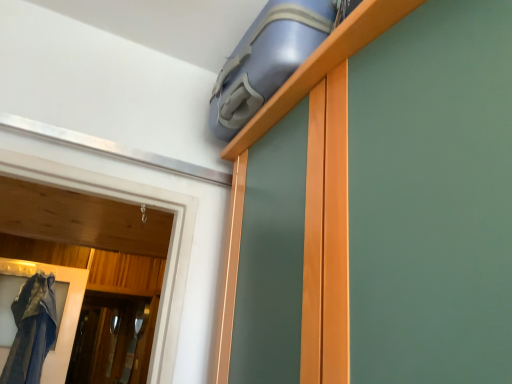
This screenshot has height=384, width=512. What do you see at coordinates (322, 65) in the screenshot?
I see `blue rubber suitcase at upper center` at bounding box center [322, 65].

At what (x,y) coordinates should I click in order to perform the action: click on blue rubber suitcase at upper center. Please return your answer as a coordinate pair (x, y). Looking at the image, I should click on (322, 65).

What do you see at coordinates (113, 339) in the screenshot?
I see `transparent glass screen door at lower left` at bounding box center [113, 339].

The image size is (512, 384). I want to click on transparent glass screen door at lower left, so coord(113,339).

At what (x,y) coordinates should I click in order to perform the action: click on blue rubber suitcase at upper center. Please return your answer as a coordinate pair (x, y). Image resolution: width=512 pixels, height=384 pixels. Looking at the image, I should click on (322, 65).

Based on the photo, is transparent glass screen door at lower left to the left of blue rubber suitcase at upper center from the viewer's perspective?

Yes.

Looking at this image, is transparent glass screen door at lower left positioned in front of blue rubber suitcase at upper center?

No, transparent glass screen door at lower left is further to the viewer.

Considering the points (118, 331) and (370, 16), which point is in front, point (118, 331) or point (370, 16)?

Point (370, 16)

Based on the photo, from the image's perspective, which is below, transparent glass screen door at lower left or blue rubber suitcase at upper center?

transparent glass screen door at lower left is shown below in the image.

From a real-world perspective, is transparent glass screen door at lower left over blue rubber suitcase at upper center?

No.

Considering the sizes of objects transparent glass screen door at lower left and blue rubber suitcase at upper center in the image provided, who is thinner, transparent glass screen door at lower left or blue rubber suitcase at upper center?

Result: Thinner between the two is transparent glass screen door at lower left.

Does transparent glass screen door at lower left have a greater height compared to blue rubber suitcase at upper center?

Yes.

Who is bigger, transparent glass screen door at lower left or blue rubber suitcase at upper center?

blue rubber suitcase at upper center.

Is transparent glass screen door at lower left not within blue rubber suitcase at upper center?

transparent glass screen door at lower left lies outside blue rubber suitcase at upper center's area.

Is transparent glass screen door at lower left positioned far away from blue rubber suitcase at upper center?

That's right, there is a large distance between transparent glass screen door at lower left and blue rubber suitcase at upper center.

Is transparent glass screen door at lower left positioned with its back to blue rubber suitcase at upper center?

No, transparent glass screen door at lower left's orientation is not away from blue rubber suitcase at upper center.

How much distance is there between transparent glass screen door at lower left and blue rubber suitcase at upper center?

transparent glass screen door at lower left is 2.91 meters from blue rubber suitcase at upper center.

Locate an element on the screen. The width and height of the screenshot is (512, 384). screen door below the blue rubber suitcase at upper center (from a real-world perspective) is located at coordinates (113, 339).

In the image, is blue rubber suitcase at upper center on the left side or the right side of transparent glass screen door at lower left?

In the image, blue rubber suitcase at upper center appears on the right side of transparent glass screen door at lower left.

Between blue rubber suitcase at upper center and transparent glass screen door at lower left, which one is positioned in front?

blue rubber suitcase at upper center is in front.

Which is behind, point (374, 4) or point (108, 298)?

The point (108, 298) is behind.

From the image's perspective, which is below, blue rubber suitcase at upper center or transparent glass screen door at lower left?

transparent glass screen door at lower left.

From a real-world perspective, which is physically below, blue rubber suitcase at upper center or transparent glass screen door at lower left?

transparent glass screen door at lower left.

Considering the sizes of objects blue rubber suitcase at upper center and transparent glass screen door at lower left in the image provided, who is thinner, blue rubber suitcase at upper center or transparent glass screen door at lower left?

Thinner between the two is transparent glass screen door at lower left.

Between blue rubber suitcase at upper center and transparent glass screen door at lower left, which one has more height?

transparent glass screen door at lower left is taller.

Does blue rubber suitcase at upper center have a smaller size compared to transparent glass screen door at lower left?

No.

Would you say transparent glass screen door at lower left is part of blue rubber suitcase at upper center's contents?

No, blue rubber suitcase at upper center does not contain transparent glass screen door at lower left.

Is blue rubber suitcase at upper center not close to transparent glass screen door at lower left?

blue rubber suitcase at upper center is far away from transparent glass screen door at lower left.

Does blue rubber suitcase at upper center turn towards transparent glass screen door at lower left?

No, blue rubber suitcase at upper center is not facing towards transparent glass screen door at lower left.

How many degrees apart are the facing directions of blue rubber suitcase at upper center and transparent glass screen door at lower left?

blue rubber suitcase at upper center and transparent glass screen door at lower left are facing 87.8 degrees away from each other.

Measure the distance from blue rubber suitcase at upper center to transparent glass screen door at lower left.

blue rubber suitcase at upper center is 2.91 meters away from transparent glass screen door at lower left.

Locate an element on the screen. The width and height of the screenshot is (512, 384). shelf in front of the transparent glass screen door at lower left is located at coordinates (322, 65).

Find the location of a particular element. shelf in front of the transparent glass screen door at lower left is located at coordinates (322, 65).

This screenshot has height=384, width=512. Identify the location of screen door that is on the left side of blue rubber suitcase at upper center. (113, 339).